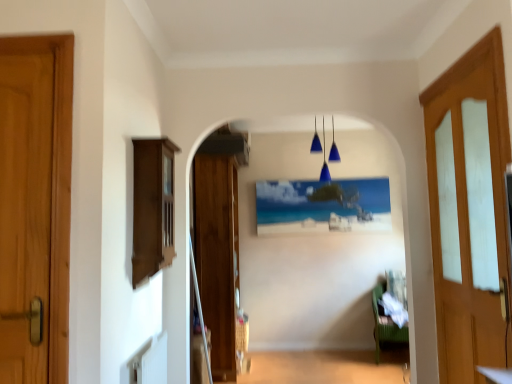
Question: Considering the positions of brown wood cabinet at left and green fabric couch at lower right in the image, is brown wood cabinet at left wider or thinner than green fabric couch at lower right?

Choices:
 (A) thin
 (B) wide

Answer: (A)

Question: Based on their sizes in the image, would you say brown wood cabinet at left is bigger or smaller than green fabric couch at lower right?

Choices:
 (A) big
 (B) small

Answer: (B)

Question: Based on their relative distances, which object is nearer to the wooden door at left, which is the third door from right to left?

Choices:
 (A) blue glass pendant lights at center
 (B) green fabric couch at lower right
 (C) wooden door at center, the second door viewed from the right
 (D) wooden staircase at center
 (E) white glossy table at lower right

Answer: (E)

Question: Which of these objects is positioned farthest from the brown wood cabinet at left?

Choices:
 (A) wooden staircase at center
 (B) light brown wooden door at right, arranged as the first door when viewed from the right
 (C) white glossy table at lower right
 (D) blue glass pendant lights at center
 (E) wooden door at left, which is the third door from right to left

Answer: (A)